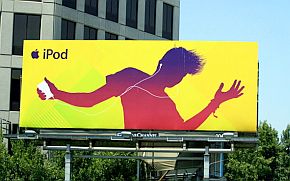
The width and height of the screenshot is (290, 181). Identify the location of head phones. (131, 87).